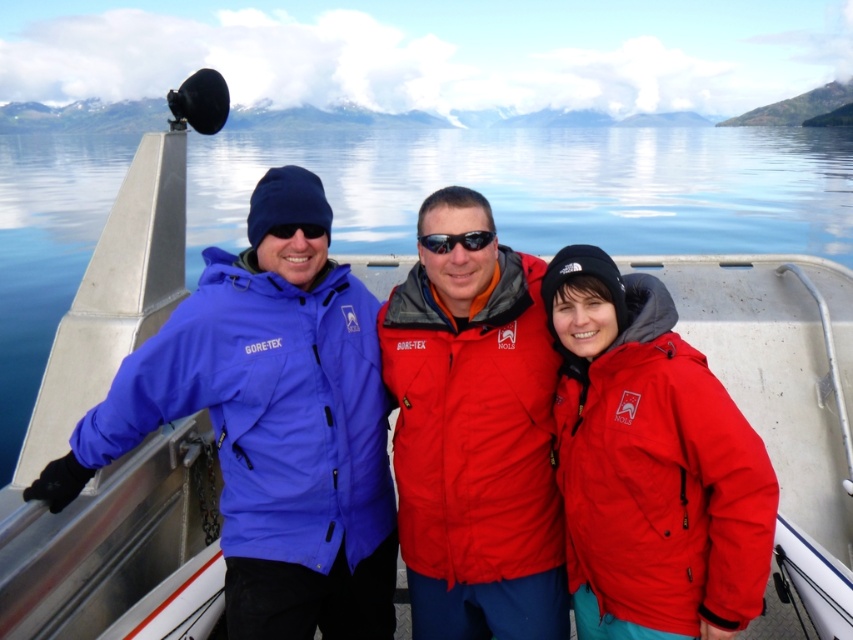
You are a photographer trying to locate the matte blue jacket at left in the image. According to the coordinates provided, where exactly should you focus your camera lens to capture it?

The matte blue jacket at left is located at point coordinates 0.664 on the x axis and 0.319 on the y axis.

Based on the scene description, which of the two jackets, the matte blue jacket at left or the red matte jacket at center, is positioned closer to the left side of the image?

The matte blue jacket at left is positioned closer to the left side of the image as it is to the left of the red matte jacket at center.

You are a photographer on the boat deck. You need to take a photo of the matte blue jacket at left and the black reflective sunglasses at center. Which object should you focus on first if you want to capture both in one frame without moving the camera?

The matte blue jacket at left is to the left of black reflective sunglasses at center, so you should focus on the matte blue jacket at left first to ensure both are in frame without moving the camera.